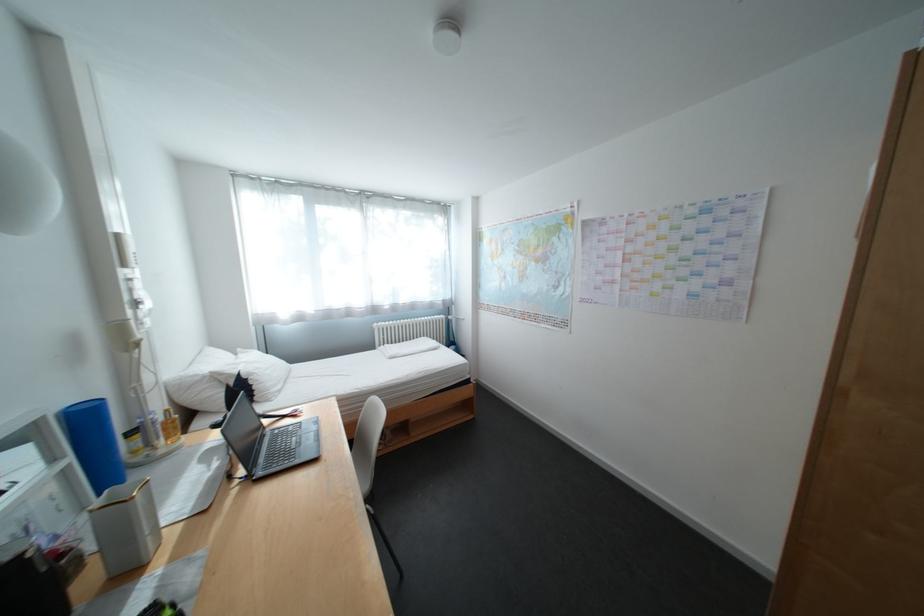
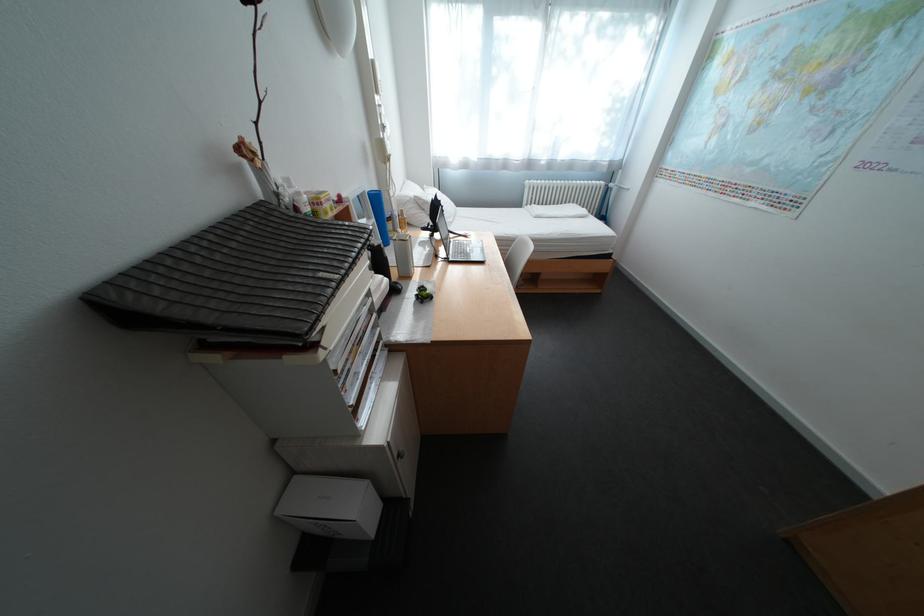
Find the pixel in the second image that matches pixel 55 418 in the first image.

(378, 192)